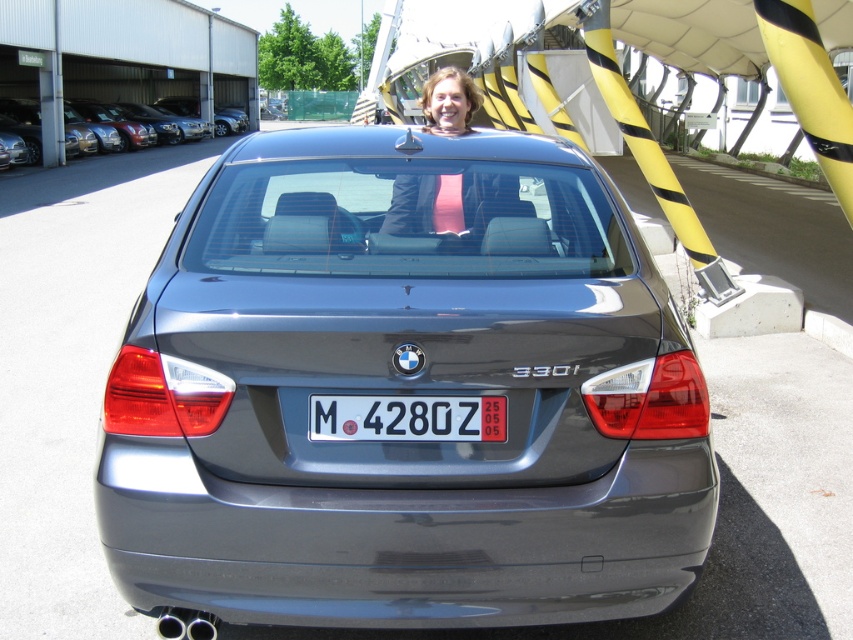
Question: Considering the real-world distances, which object is closest to the pink fabric at center?

Choices:
 (A) satin metallic sedan at upper left
 (B) satin metallic car at center
 (C) white plastic license plate at center

Answer: (B)

Question: Considering the relative positions of pink fabric at center and satin metallic sedan at upper left in the image provided, where is pink fabric at center located with respect to satin metallic sedan at upper left?

Choices:
 (A) above
 (B) below

Answer: (B)

Question: Does satin metallic car at center appear on the right side of white plastic license plate at center?

Choices:
 (A) no
 (B) yes

Answer: (A)

Question: Among these objects, which one is nearest to the camera?

Choices:
 (A) satin metallic car at center
 (B) pink fabric at center
 (C) satin metallic sedan at upper left

Answer: (A)

Question: Can you confirm if pink fabric at center is positioned to the right of satin metallic sedan at upper left?

Choices:
 (A) no
 (B) yes

Answer: (B)

Question: Which is nearer to the satin metallic sedan at upper left?

Choices:
 (A) pink fabric at center
 (B) white plastic license plate at center
 (C) satin metallic car at center

Answer: (C)